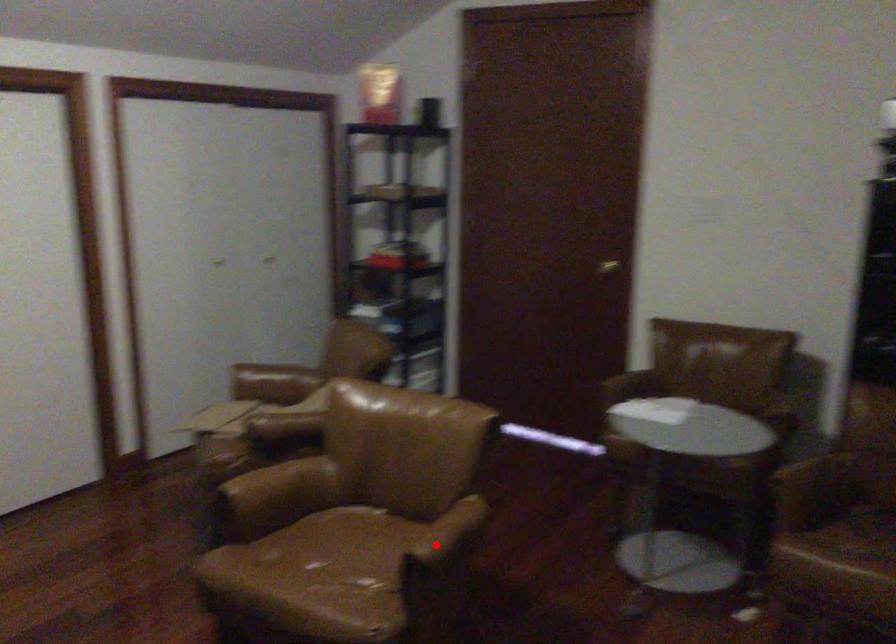
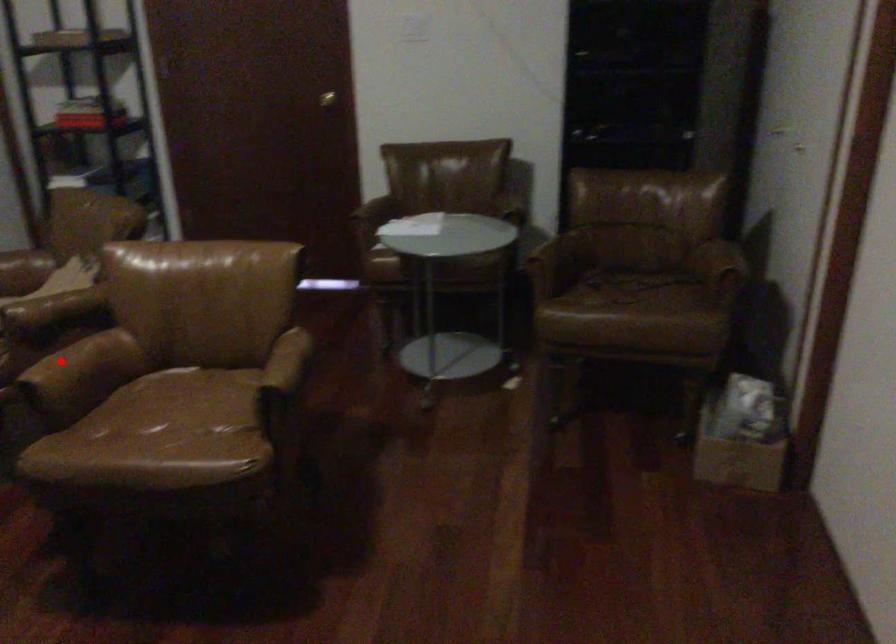
I am providing you with two images of the same scene from different viewpoints. A red point is marked on the first image and another point is marked on the second image. Does the point marked in image1 correspond to the same location as the one in image2?

No